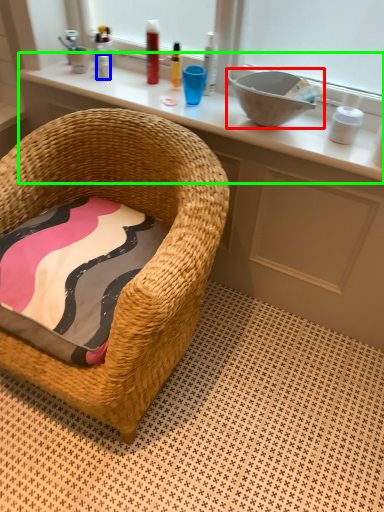
Question: Which object is positioned closest to sink (highlighted by a red box)? Select from toiletry (highlighted by a blue box) and changing table (highlighted by a green box).

Choices:
 (A) toiletry
 (B) changing table

Answer: (B)